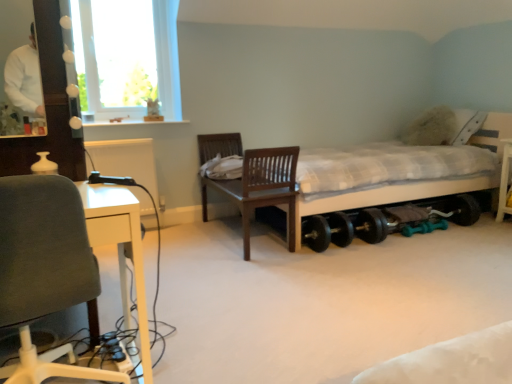
You are a GUI agent. You are given a task and a screenshot of the screen. Output one action in this format:
    pyautogui.click(x=<x>, y=<y>)
    Task: Click on the vacant area located to the right-hand side of gray fabric chair at left, which appears as the 1th chair when viewed from the left
    This screenshot has width=512, height=384.
    Given the screenshot: What is the action you would take?
    pyautogui.click(x=202, y=355)